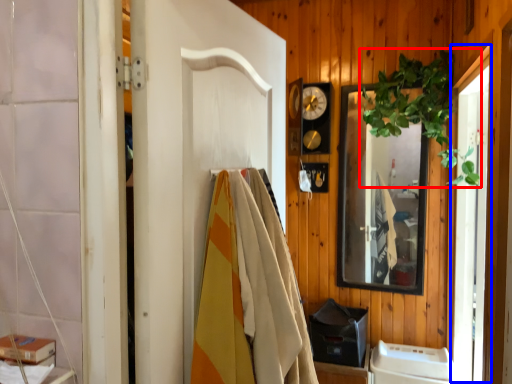
Question: Which object appears closest to the camera in this image, plant (highlighted by a red box) or screen door (highlighted by a blue box)?

Choices:
 (A) plant
 (B) screen door

Answer: (B)